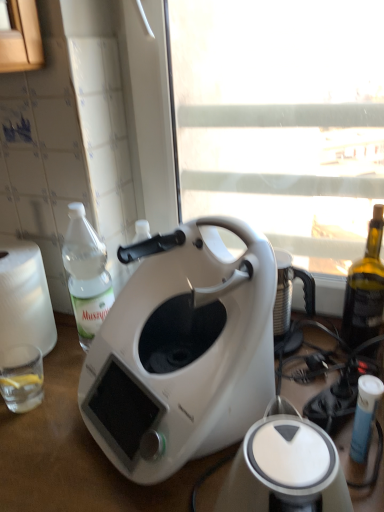
What are the coordinates of `vacant space situated above white plastic toaster at center (from a real-world perspective)` in the screenshot? It's located at (291, 462).